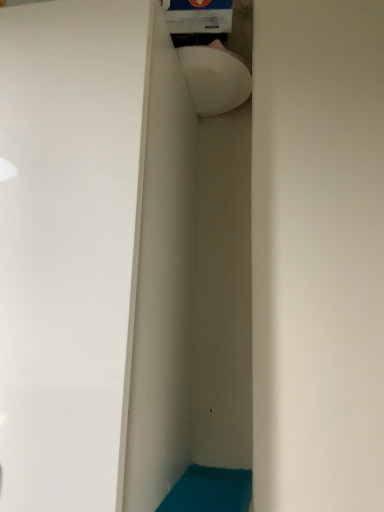
In the scene shown: Measure the distance between white glossy door at center and camera.

14.59 inches.

You are a GUI agent. You are given a task and a screenshot of the screen. Output one action in this format:
    pyautogui.click(x=<x>, y=<y>)
    Task: Click on the white glossy door at center
    This screenshot has width=384, height=512.
    Given the screenshot: What is the action you would take?
    pyautogui.click(x=93, y=257)

This screenshot has height=512, width=384. What do you see at coordinates (93, 257) in the screenshot?
I see `white glossy door at center` at bounding box center [93, 257].

This screenshot has width=384, height=512. In order to click on white glossy door at center in this screenshot , I will do `click(93, 257)`.